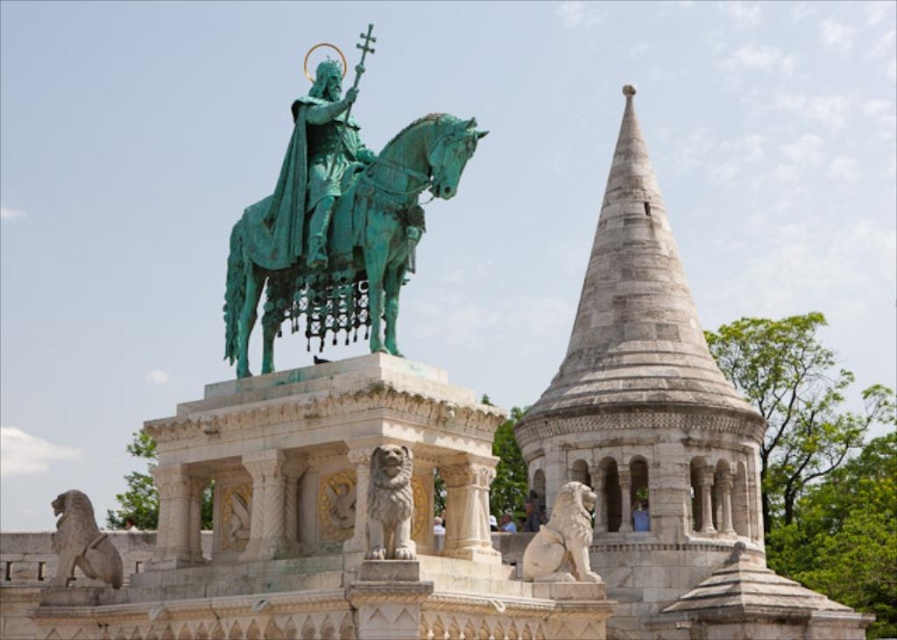
You are standing at the center of the monument and want to take a photo of the white stone tower at center right. Which direction should you face to ensure the tower is in the center of your photo?

To center the white stone tower at center right in your photo, you should face towards the direction where the tower is located, which is at the center right position relative to your current standpoint at the monument center.

You are standing in front of the historical monument and want to take a photo of the white stone tower at center right. Considering your camera has a maximum zoom range of 100 meters, will you be able to capture the entire tower in the photo without moving closer?

The white stone tower at center right is 98.70 meters away from the viewer. Since the camera can zoom up to 100 meters, you can capture the entire tower without moving closer.

You are standing in front of the monument and want to take a photo that includes both the white stone tower at center right and the white stone lion at center. Based on their positions, which object should be on the left side of your photo?

The white stone lion at center should be on the left side of your photo because the white stone tower at center right is to the right of it.